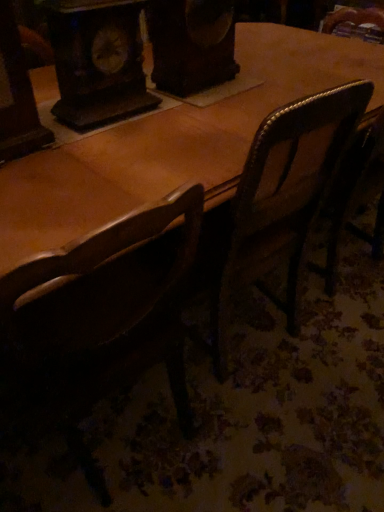
Question: Would you say brown wooden chair at left is inside or outside wooden clock at upper left?

Choices:
 (A) inside
 (B) outside

Answer: (B)

Question: In the image, is brown wooden chair at left positioned in front of or behind wooden clock at upper left?

Choices:
 (A) behind
 (B) front

Answer: (B)

Question: From a real-world perspective, is brown wooden chair at left positioned above or below wooden clock at upper left?

Choices:
 (A) above
 (B) below

Answer: (B)

Question: Looking at the image, does wooden clock at upper left seem bigger or smaller compared to brown wooden chair at left?

Choices:
 (A) big
 (B) small

Answer: (B)

Question: Relative to brown wooden chair at left, is wooden clock at upper left in front or behind?

Choices:
 (A) front
 (B) behind

Answer: (B)

Question: Is point (69, 121) positioned closer to the camera than point (51, 321)?

Choices:
 (A) farther
 (B) closer

Answer: (A)

Question: From a real-world perspective, relative to brown wooden chair at left, is wooden clock at upper left vertically above or below?

Choices:
 (A) above
 (B) below

Answer: (A)